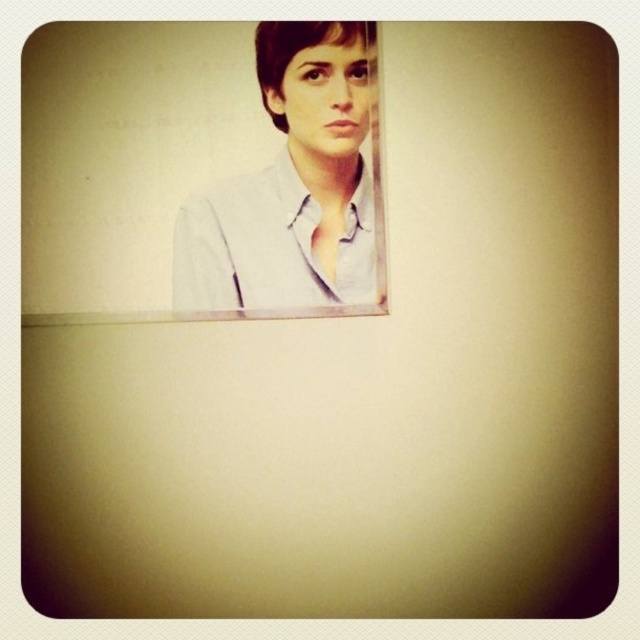
You are an interior designer analyzing the wall decor. You see a point marked at coordinates (292, 184). What object is located at that point?

The point at coordinates (292, 184) marks the light blue shirt at upper center.

You are an interior designer arranging a gallery wall. You have two shirts displayed at the upper center of the wall. The light blue shirt at upper center and the matte gray shirt at upper center. Which shirt is positioned in front of the other?

The light blue shirt at upper center is in front of the matte gray shirt at upper center because the matte gray shirt at upper center is behind it.